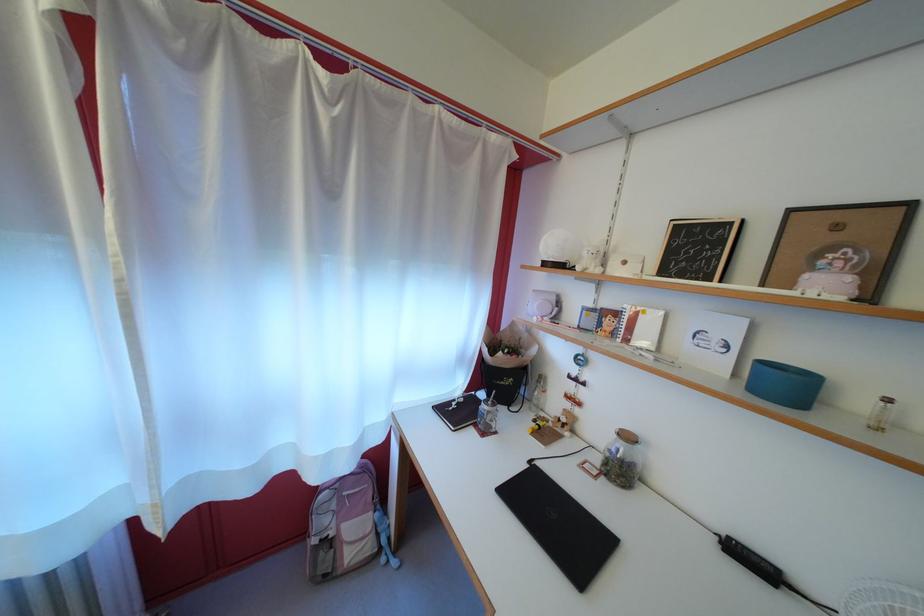
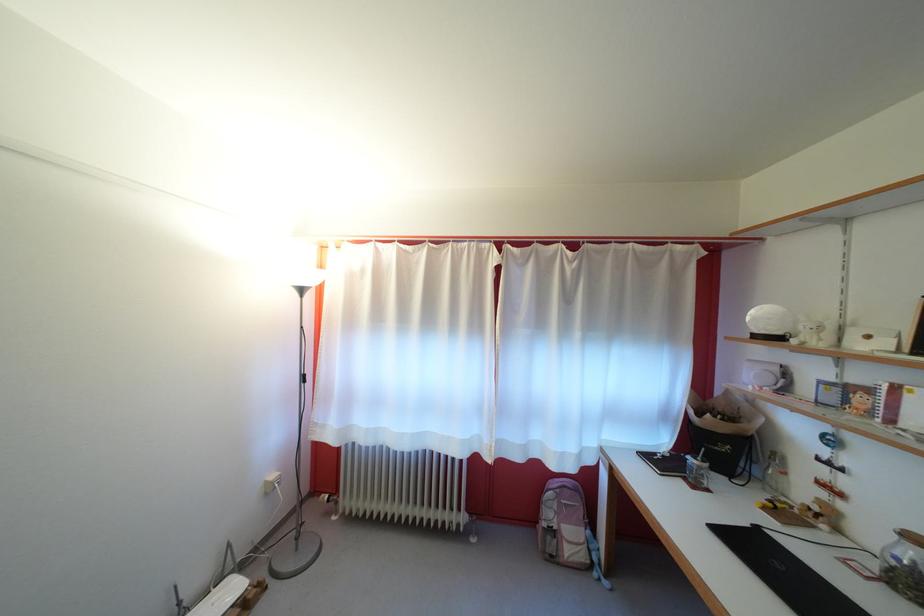
The point at (497, 418) is marked in the first image. Where is the corresponding point in the second image?

(708, 474)